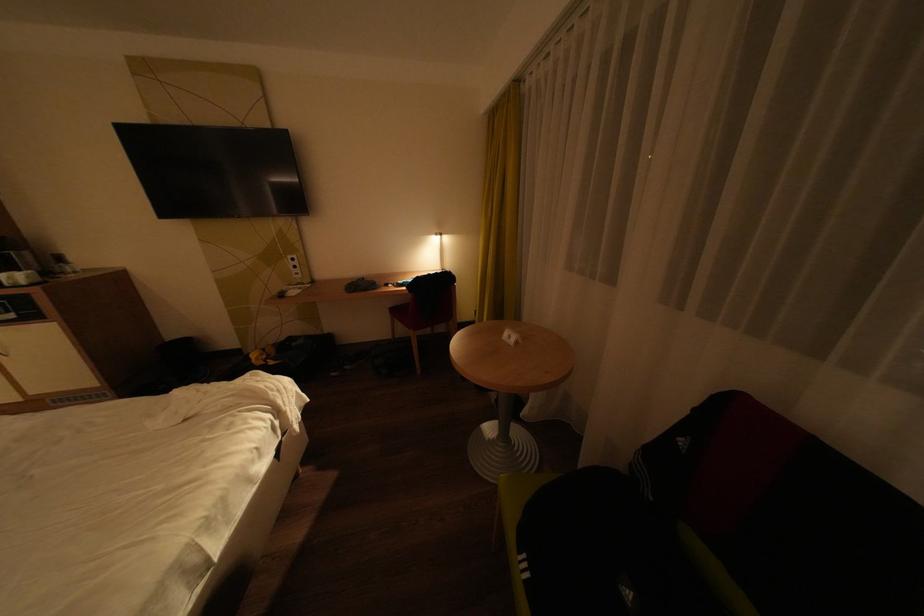
Image resolution: width=924 pixels, height=616 pixels. Describe the element at coordinates (796, 531) in the screenshot. I see `the sofa sitting surface` at that location.